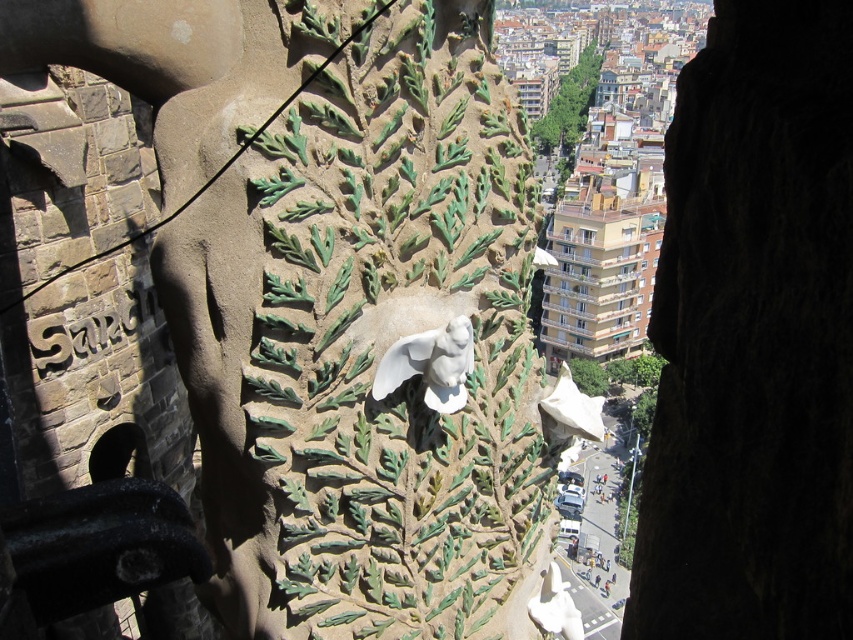
Question: Which of the following is the farthest from the observer?

Choices:
 (A) (381, 74)
 (B) (442, 385)

Answer: (B)

Question: Does white stone bird at center have a lesser width compared to white glossy statue at center?

Choices:
 (A) no
 (B) yes

Answer: (A)

Question: Is white stone bird at center below white glossy statue at center?

Choices:
 (A) yes
 (B) no

Answer: (B)

Question: From the image, what is the correct spatial relationship of white stone bird at center in relation to white glossy statue at center?

Choices:
 (A) left
 (B) right

Answer: (A)

Question: Among these objects, which one is farthest from the camera?

Choices:
 (A) white glossy statue at center
 (B) white stone bird at center

Answer: (A)